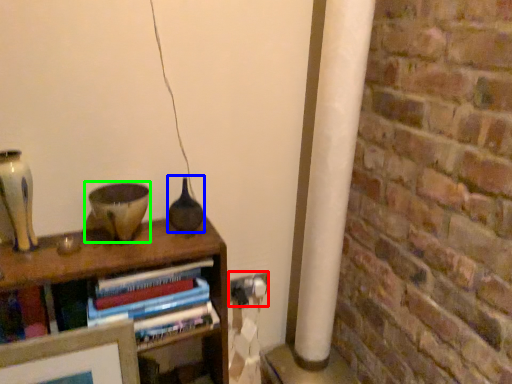
Question: Which is nearer to the electric outlet (highlighted by a red box)? glass vase (highlighted by a blue box) or candle holder (highlighted by a green box).

Choices:
 (A) glass vase
 (B) candle holder

Answer: (A)